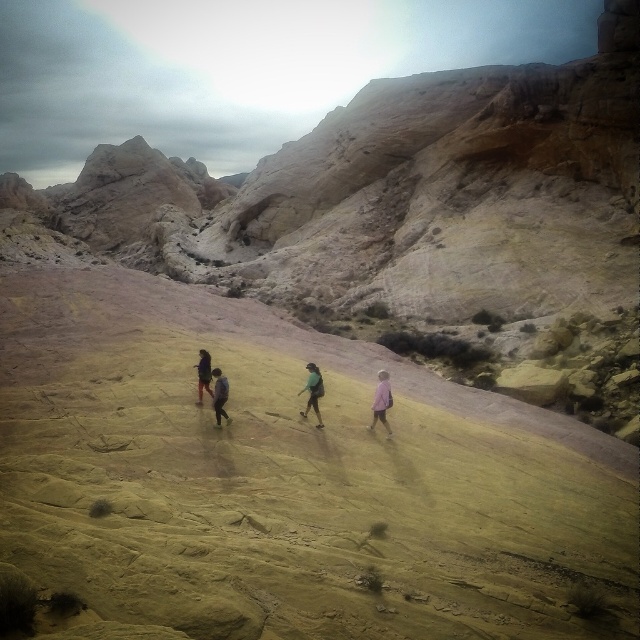
Measure the distance between pink fabric at center and dark gray fabric jacket at center.

The distance of pink fabric at center from dark gray fabric jacket at center is 38.98 feet.

Can you confirm if pink fabric at center is positioned below dark gray fabric jacket at center?

Incorrect, pink fabric at center is not positioned below dark gray fabric jacket at center.

Is point (371, 406) positioned behind point (212, 372)?

Yes, point (371, 406) is farther from viewer.

Image resolution: width=640 pixels, height=640 pixels. Find the location of `pink fabric at center`. pink fabric at center is located at coordinates (381, 401).

Is green fabric jacket at center bigger than dark gray fabric jacket at center?

Indeed, green fabric jacket at center has a larger size compared to dark gray fabric jacket at center.

Is point (312, 362) positioned in front of point (221, 412)?

No.

Identify the location of green fabric jacket at center. (312, 392).

Is pink fabric at center to the right of green fabric jacket at center from the viewer's perspective?

Yes, pink fabric at center is to the right of green fabric jacket at center.

Locate an element on the screen. pink fabric at center is located at coordinates (381, 401).